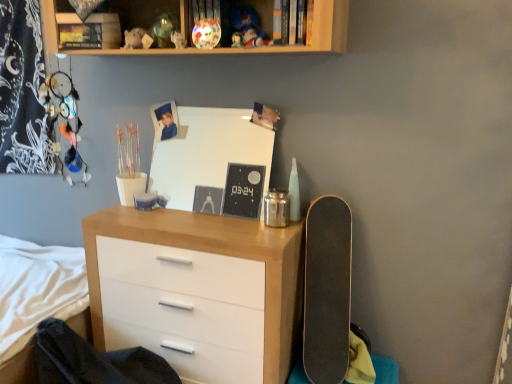
This screenshot has height=384, width=512. What do you see at coordinates (275, 46) in the screenshot? I see `wooden shelf at upper center` at bounding box center [275, 46].

Measure the distance between point (52, 2) and camera.

The distance of point (52, 2) from camera is 1.73 meters.

This screenshot has width=512, height=384. What do you see at coordinates (178, 40) in the screenshot? I see `matte white figurine at upper center` at bounding box center [178, 40].

At what (x,y) coordinates should I click in order to perform the action: click on black matte skateboard at right. Please return your answer as a coordinate pair (x, y). Looking at the image, I should click on (327, 290).

Is hardcover book at upper center smaller than wooden chest of drawers at center?

Yes.

Considering the relative sizes of hardcover book at upper center and wooden chest of drawers at center in the image provided, is hardcover book at upper center taller than wooden chest of drawers at center?

No, hardcover book at upper center is not taller than wooden chest of drawers at center.

Which is behind, point (301, 15) or point (203, 263)?

The point (203, 263) is behind.

Is hardcover book at upper center situated inside wooden chest of drawers at center or outside?

hardcover book at upper center exists outside the volume of wooden chest of drawers at center.

Can black matte skateboard at right be found inside hardcover book at upper center?

That's incorrect, black matte skateboard at right is not inside hardcover book at upper center.

Considering the positions of points (295, 8) and (312, 210), is point (295, 8) closer to camera compared to point (312, 210)?

Yes, it is in front of point (312, 210).

Find the location of `book above the black matte skateboard at right (from the image's perspective)`. book above the black matte skateboard at right (from the image's perspective) is located at coordinates (289, 22).

Considering the relative positions of hardcover book at upper center and black matte skateboard at right in the image provided, is hardcover book at upper center to the left of black matte skateboard at right from the viewer's perspective?

Indeed, hardcover book at upper center is positioned on the left side of black matte skateboard at right.

Which is closer to the camera, (342, 35) or (288, 27)?

The point (342, 35) is closer.

From a real-world perspective, is wooden shelf at upper center positioned above or below hardcover book at upper center?

wooden shelf at upper center is situated higher than hardcover book at upper center in the real world.

Considering the relative sizes of wooden shelf at upper center and hardcover book at upper center in the image provided, is wooden shelf at upper center thinner than hardcover book at upper center?

Incorrect, the width of wooden shelf at upper center is not less than that of hardcover book at upper center.

From the image's perspective, relative to hardcover book at upper center, is wooden shelf at upper center above or below?

wooden shelf at upper center is above hardcover book at upper center.

Is matte white figurine at upper center outside of wooden chest of drawers at center?

matte white figurine at upper center lies outside wooden chest of drawers at center's area.

Is matte white figurine at upper center next to wooden chest of drawers at center?

There is a gap between matte white figurine at upper center and wooden chest of drawers at center.

From the image's perspective, which one is positioned lower, matte white figurine at upper center or wooden chest of drawers at center?

From the image's view, wooden chest of drawers at center is below.

Can you confirm if matte white figurine at upper center is bigger than wooden chest of drawers at center?

No.

Considering the positions of objects wooden chest of drawers at center and wooden shelf at upper center in the image provided, who is in front, wooden chest of drawers at center or wooden shelf at upper center?

wooden shelf at upper center is closer to the camera.

Locate an element on the screen. Image resolution: width=512 pixels, height=384 pixels. chest of drawers behind the wooden shelf at upper center is located at coordinates (197, 290).

Is wooden chest of drawers at center facing away from wooden shelf at upper center?

No, wooden shelf at upper center is not at the back of wooden chest of drawers at center.

Between wooden chest of drawers at center and wooden shelf at upper center, which one has larger width?

wooden chest of drawers at center is wider.

From a real-world perspective, is matte white figurine at upper center positioned above or below wooden shelf at upper center?

Clearly, from a real-world perspective, matte white figurine at upper center is below wooden shelf at upper center.

Is matte white figurine at upper center placed right next to wooden shelf at upper center?

No.

In terms of height, does matte white figurine at upper center look taller or shorter compared to wooden shelf at upper center?

Clearly, matte white figurine at upper center is shorter compared to wooden shelf at upper center.

From the image's perspective, relative to hardcover book at upper center, is black matte skateboard at right above or below?

Based on their image positions, black matte skateboard at right is located beneath hardcover book at upper center.

Looking at the image, does black matte skateboard at right seem bigger or smaller compared to hardcover book at upper center?

Considering their sizes, black matte skateboard at right takes up more space than hardcover book at upper center.

Is black matte skateboard at right positioned with its back to hardcover book at upper center?

black matte skateboard at right does not have its back to hardcover book at upper center.

Locate an element on the screen. This screenshot has width=512, height=384. chest of drawers below the hardcover book at upper center (from a real-world perspective) is located at coordinates (197, 290).

Where is `book above the black matte skateboard at right (from a real-world perspective)`? book above the black matte skateboard at right (from a real-world perspective) is located at coordinates (289, 22).

When comparing their distances from matte white figurine at upper center, does hardcover book at upper center or wooden shelf at upper center seem closer?

Based on the image, wooden shelf at upper center appears to be nearer to matte white figurine at upper center.

Looking at the image, which one is located further to wooden shelf at upper center, matte white figurine at upper center or black matte skateboard at right?

black matte skateboard at right is positioned further to the anchor wooden shelf at upper center.

Considering their positions, is black matte skateboard at right positioned further to hardcover book at upper center than wooden chest of drawers at center?

Among the two, wooden chest of drawers at center is located further to hardcover book at upper center.

Which object lies nearer to the anchor point matte white figurine at upper center, black matte skateboard at right or wooden chest of drawers at center?

wooden chest of drawers at center is closer to matte white figurine at upper center.

From the image, which object appears to be nearer to black matte skateboard at right, hardcover book at upper center or matte white figurine at upper center?

The object closer to black matte skateboard at right is hardcover book at upper center.

When comparing their distances from hardcover book at upper center, does wooden chest of drawers at center or black matte skateboard at right seem closer?

Among the two, black matte skateboard at right is located nearer to hardcover book at upper center.

Considering their positions, is matte white figurine at upper center positioned further to hardcover book at upper center than wooden shelf at upper center?

The object further to hardcover book at upper center is matte white figurine at upper center.

From the image, which object appears to be nearer to wooden chest of drawers at center, matte white figurine at upper center or wooden shelf at upper center?

wooden shelf at upper center.

Image resolution: width=512 pixels, height=384 pixels. Identify the location of skateboard between wooden shelf at upper center and wooden chest of drawers at center from top to bottom. (327, 290).

This screenshot has width=512, height=384. In order to click on skateboard between matte white figurine at upper center and wooden chest of drawers at center vertically in this screenshot , I will do `click(327, 290)`.

At what (x,y) coordinates should I click in order to perform the action: click on toy between wooden shelf at upper center and wooden chest of drawers at center in the up-down direction. Please return your answer as a coordinate pair (x, y). Looking at the image, I should click on (178, 40).

This screenshot has height=384, width=512. What are the coordinates of `shelf located between matte white figurine at upper center and hardcover book at upper center in the left-right direction` in the screenshot? It's located at (275, 46).